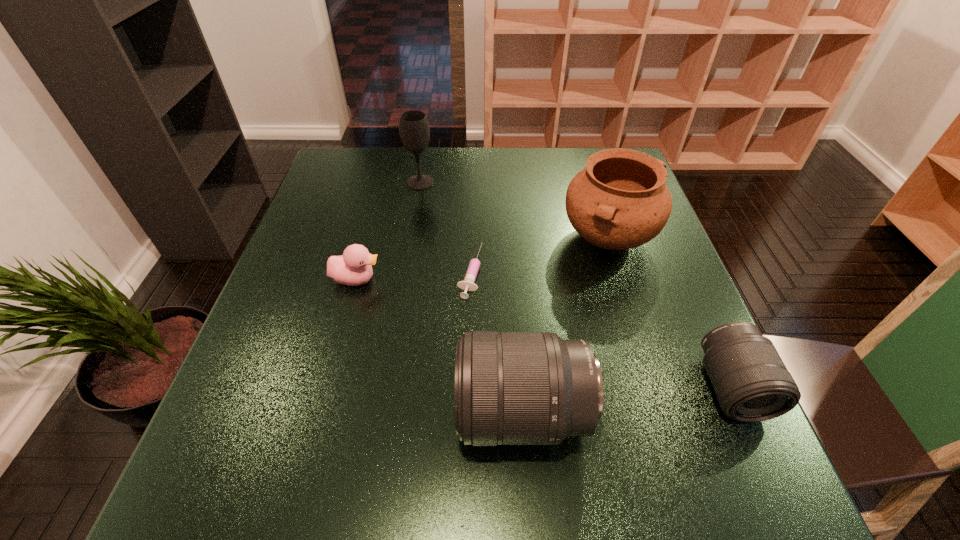
I want to click on free space that is in between the duckling and the syringe, so click(x=414, y=276).

Where is `free space between the left telephoto lens and the shorter telephoto lens`? This screenshot has height=540, width=960. free space between the left telephoto lens and the shorter telephoto lens is located at coordinates (627, 400).

Where is `unoccupied area between the second shortest object and the left telephoto lens`? Image resolution: width=960 pixels, height=540 pixels. unoccupied area between the second shortest object and the left telephoto lens is located at coordinates (440, 346).

Select which object is the third closest to the farthest object. Please provide its 2D coordinates. Your answer should be formatted as a tuple, i.e. [(x, y)], where the tuple contains the x and y coordinates of a point satisfying the conditions above.

[(620, 201)]

Identify the location of object that is the closest one to the left telephoto lens. (467, 284).

Locate an element on the screen. The image size is (960, 540). vacant space that satisfies the following two spatial constraints: 1. on the surface of the right telephoto lens; 2. on the surface of the left telephoto lens is located at coordinates (743, 413).

You are a GUI agent. You are given a task and a screenshot of the screen. Output one action in this format:
    pyautogui.click(x=<x>, y=<y>)
    Task: Click on the blank area in the image that satisfies the following two spatial constraints: 1. on the front side of the shortest object; 2. on the front-facing side of the duckling
    This screenshot has width=960, height=540.
    Given the screenshot: What is the action you would take?
    pyautogui.click(x=470, y=279)